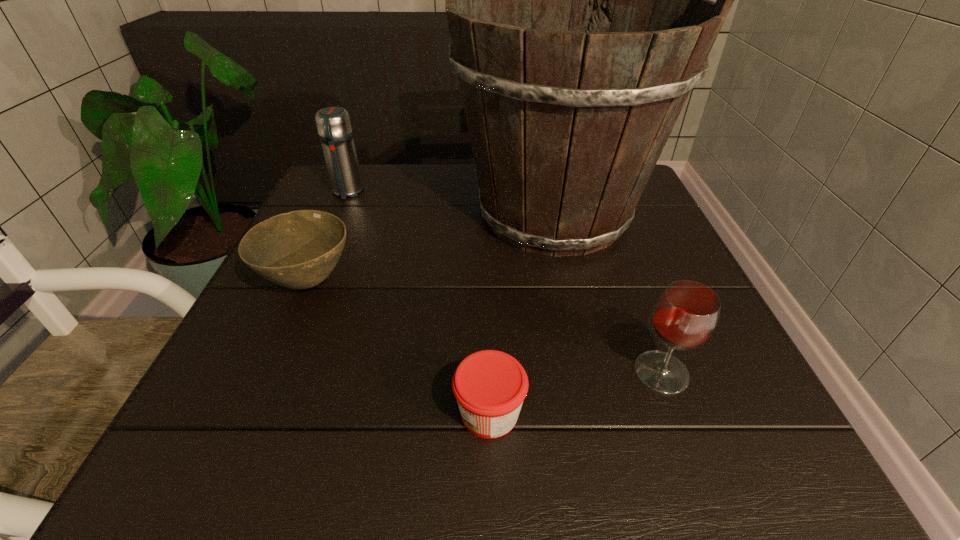
Locate an element on the screen. The height and width of the screenshot is (540, 960). object present at the far right corner is located at coordinates (567, 118).

I want to click on blank space at the near edge of the desktop, so click(639, 434).

At what (x,y) coordinates should I click in order to perform the action: click on vacant space at the left edge. Please return your answer as a coordinate pair (x, y). The width and height of the screenshot is (960, 540). Looking at the image, I should click on (300, 349).

Identify the location of vacant space at the right edge of the desktop. (719, 329).

This screenshot has height=540, width=960. I want to click on free space at the far left corner of the desktop, so click(x=326, y=185).

The width and height of the screenshot is (960, 540). I want to click on free spot between the bowl and the tallest object, so click(x=431, y=248).

In order to click on vacant region between the second tallest object and the bucket in this screenshot , I will do `click(450, 203)`.

Locate an element on the screen. The width and height of the screenshot is (960, 540). free spot between the bucket and the third shortest object is located at coordinates (608, 293).

Identify the location of unoccupied area between the wineglass and the jam. The width and height of the screenshot is (960, 540). (575, 393).

This screenshot has height=540, width=960. I want to click on vacant space in between the shortest object and the bowl, so coord(398,347).